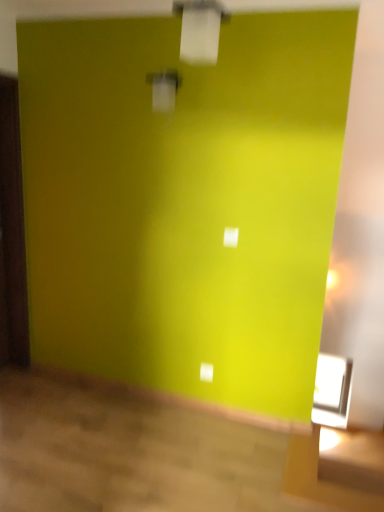
Locate an element on the screen. This screenshot has width=384, height=512. clear glass window at lower right is located at coordinates (332, 391).

This screenshot has width=384, height=512. What do you see at coordinates (332, 391) in the screenshot?
I see `clear glass window at lower right` at bounding box center [332, 391].

The image size is (384, 512). Identify the location of clear glass window at lower right. (332, 391).